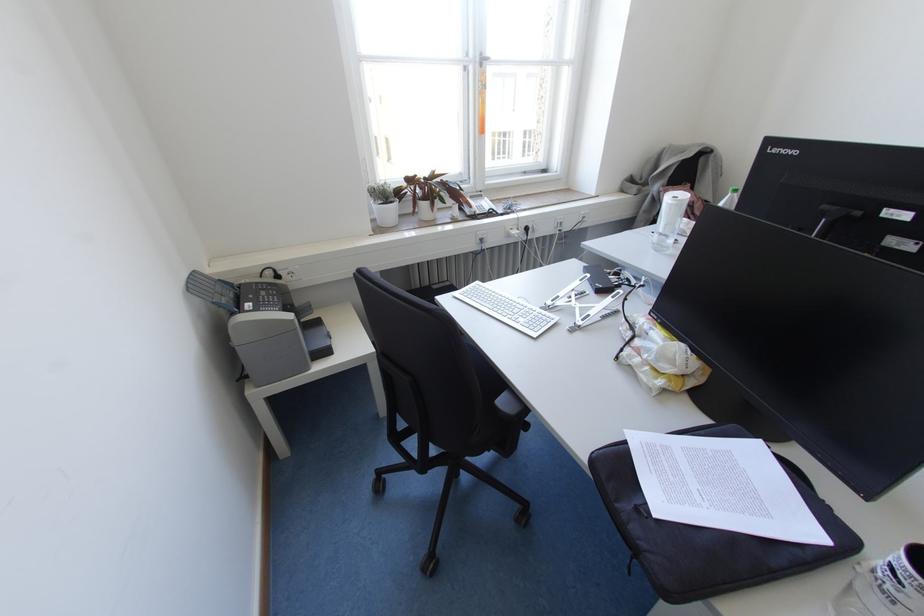
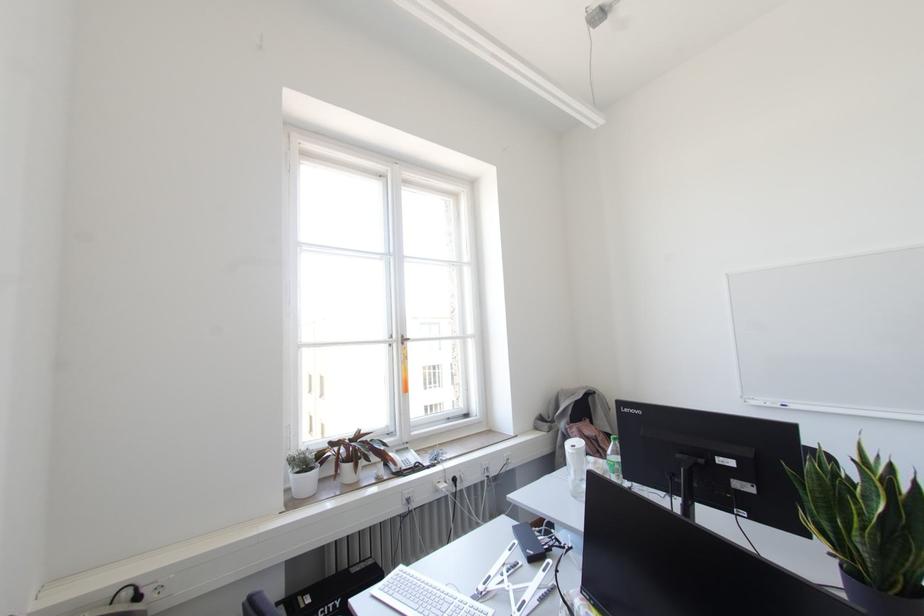
Question: The first image is from the beginning of the video and the second image is from the end. How did the camera likely rotate when shooting the video?

Choices:
 (A) Left
 (B) Right
 (C) Up
 (D) Down

Answer: (C)